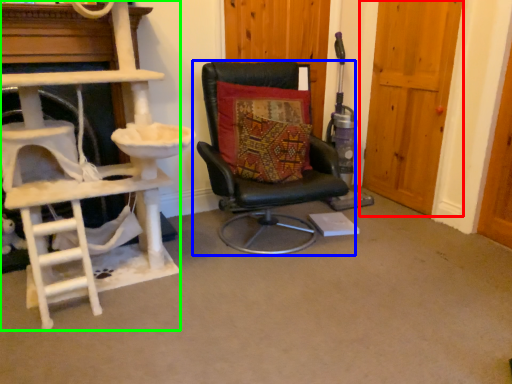
Question: Estimate the real-world distances between objects in this image. Which object is farther from door (highlighted by a red box), chair (highlighted by a blue box) or ladder (highlighted by a green box)?

Choices:
 (A) chair
 (B) ladder

Answer: (B)